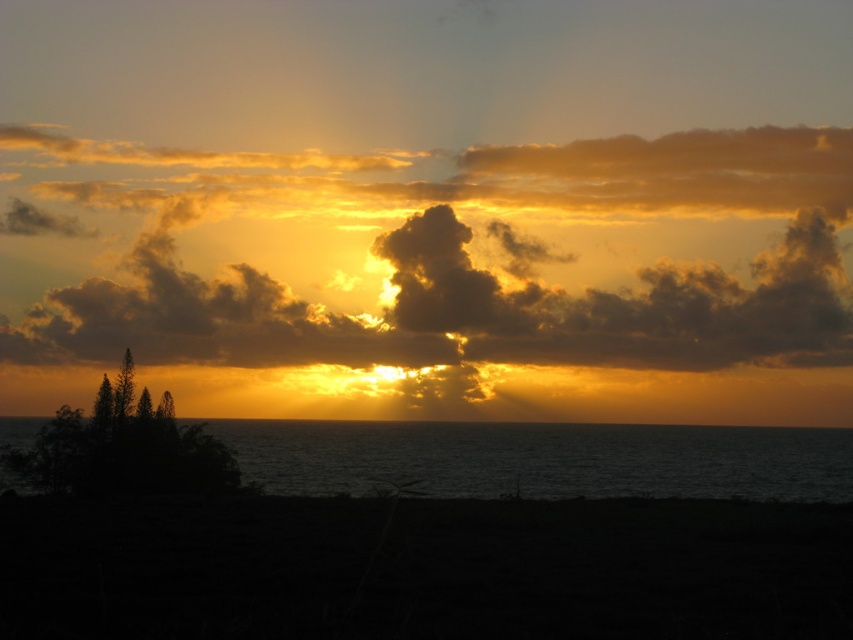
Consider the image. You are a photographer trying to capture the sunset. You notice the golden matte cloud at upper center and the dark water at lower center in your viewfinder. Which object is positioned higher in the frame?

The golden matte cloud at upper center is positioned higher in the frame than the dark water at lower center, as it is located above it.

You are an artist trying to paint the sunset scene. You notice the golden matte cloud at upper center and the dark water at lower center. Which object should you paint first if you want to follow the rule of painting smaller objects before larger ones?

The golden matte cloud at upper center should be painted first because it has a smaller size compared to the dark water at lower center.